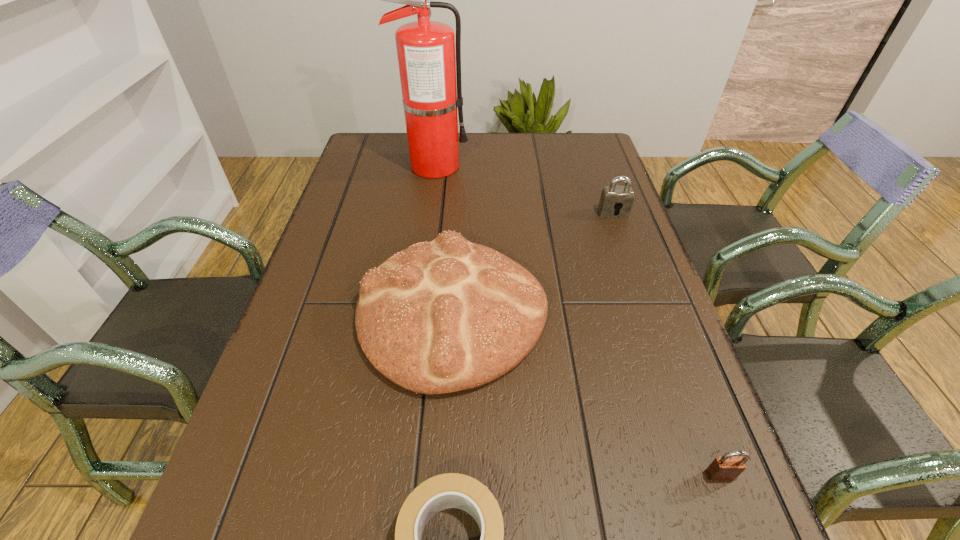
At what (x,y) coordinates should I click in order to perform the action: click on vacant region located at the front of the taller padlock near the keyhole. Please return your answer as a coordinate pair (x, y). Looking at the image, I should click on (625, 246).

At what (x,y) coordinates should I click in order to perform the action: click on free space located on the front-facing side of the nearer padlock. Please return your answer as a coordinate pair (x, y). The width and height of the screenshot is (960, 540). Looking at the image, I should click on (737, 522).

Where is `object present at the far edge`? The image size is (960, 540). object present at the far edge is located at coordinates (428, 68).

Locate an element on the screen. fire extinguisher at the left edge is located at coordinates (428, 68).

This screenshot has height=540, width=960. I want to click on bread at the left edge, so click(x=438, y=317).

Find the location of `object that is at the far left corner`. object that is at the far left corner is located at coordinates (428, 68).

At what (x,y) coordinates should I click in order to perform the action: click on vacant space at the far edge of the desktop. Please return your answer as a coordinate pair (x, y). This screenshot has height=540, width=960. Looking at the image, I should click on (513, 135).

The width and height of the screenshot is (960, 540). In order to click on free region at the left edge of the desktop in this screenshot , I will do `click(297, 351)`.

In order to click on free space at the right edge of the desktop in this screenshot , I will do `click(588, 243)`.

You are a GUI agent. You are given a task and a screenshot of the screen. Output one action in this format:
    pyautogui.click(x=<x>, y=<y>)
    Task: Click on the free area in between the second nearest object and the second farthest object
    
    Given the screenshot: What is the action you would take?
    pyautogui.click(x=666, y=344)